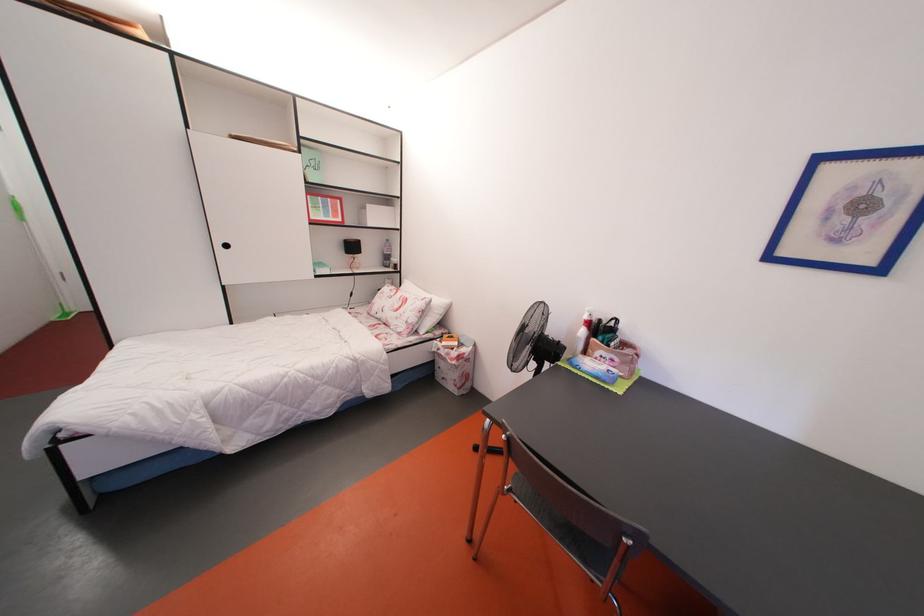
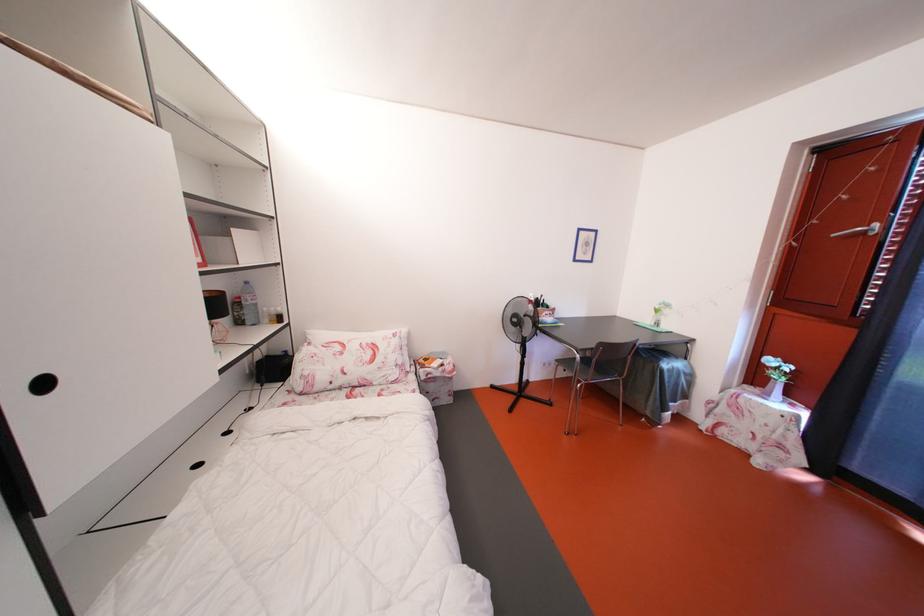
In the second image, find the point that corresponds to [395,246] in the first image.

(253, 288)